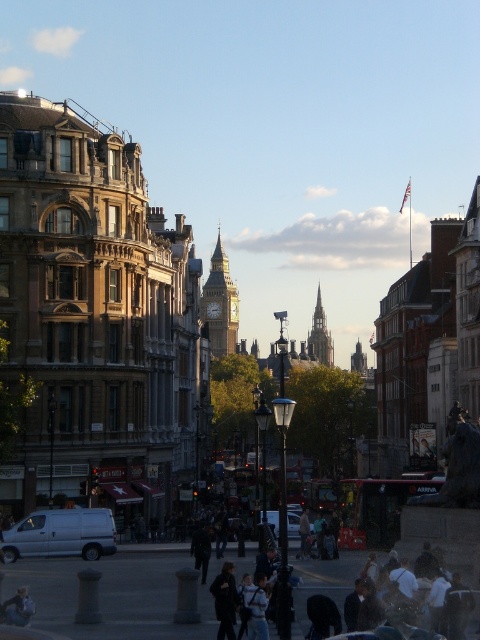
You are a tourist standing on the street and want to take a photo of both the golden stone clock tower at center and the metallic silver van at center. Which object should you position closer to the left side of your camera frame?

You should position the golden stone clock tower at center closer to the left side of your camera frame because it is already positioned on the left side of the metallic silver van at center.

You are a tourist standing on the street and want to take a photo of the golden stone clock tower at center and the dark gray jacket at center. Which object should you focus on first if you want to capture both in one frame without moving your camera?

The golden stone clock tower at center is positioned on the left side of the dark gray jacket at center, so you should focus on the golden stone clock tower at center first to ensure it stays in frame while adjusting the camera angle to include the dark gray jacket at center.

Looking at this image, you are a photographer planning to capture a wide shot of the golden stone clock tower at center and the metallic silver van at center in the same frame. Given their sizes, which object will appear bigger in your photo?

The golden stone clock tower at center will appear bigger in the photo because it has a larger size compared to the metallic silver van at center.